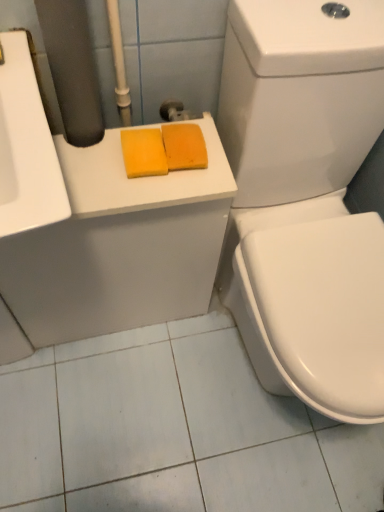
At what (x,y) coordinates should I click in order to perform the action: click on free space in front of white glossy toilet at right. Please return your answer as a coordinate pair (x, y). Looking at the image, I should click on (232, 458).